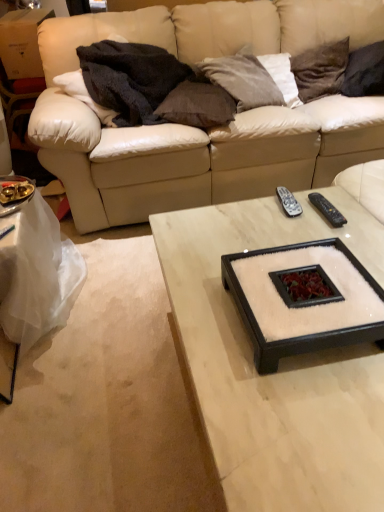
What are the coordinates of `beige leather couch at upper center` in the screenshot? It's located at (x=208, y=129).

How much space does white marble coffee table at center, which is counted as the first coffee table, starting from the right, occupy vertically?

The height of white marble coffee table at center, which is counted as the first coffee table, starting from the right, is 16.64 inches.

What is the approximate width of gray suede pillow at upper center, the 3th pillow when ordered from right to left?

It is 15.73 inches.

What is the approximate height of black plastic remote control at center, the 1th remote control from the left?

The height of black plastic remote control at center, the 1th remote control from the left, is 1.70 inches.

What is the approximate width of white felt square tray at center?

white felt square tray at center is 15.05 inches wide.

This screenshot has height=512, width=384. What do you see at coordinates (365, 71) in the screenshot?
I see `dark gray fabric pillow at upper right, acting as the 4th pillow starting from the left` at bounding box center [365, 71].

The width and height of the screenshot is (384, 512). Identify the location of beige leather couch at upper center. (208, 129).

Which of these two, brown fabric pillow at upper center, which ranks as the first pillow in left-to-right order, or white felt square tray at center, stands shorter?

Standing shorter between the two is white felt square tray at center.

Which is correct: brown fabric pillow at upper center, arranged as the 4th pillow when viewed from the right, is inside white felt square tray at center, or outside of it?

brown fabric pillow at upper center, arranged as the 4th pillow when viewed from the right, lies outside white felt square tray at center.

Where is `the 1st pillow behind the white felt square tray at center`? This screenshot has width=384, height=512. the 1st pillow behind the white felt square tray at center is located at coordinates (197, 105).

Is brown fabric pillow at upper center, which ranks as the first pillow in left-to-right order, looking in the opposite direction of white felt square tray at center?

No, brown fabric pillow at upper center, which ranks as the first pillow in left-to-right order,'s orientation is not away from white felt square tray at center.

Is black plastic remote control at right, marked as the second remote control in a left-to-right arrangement, outside of dark fuzzy blanket at upper left?

Yes, black plastic remote control at right, marked as the second remote control in a left-to-right arrangement, is located beyond the bounds of dark fuzzy blanket at upper left.

Is black plastic remote control at right, marked as the first remote control in a right-to-left arrangement, oriented towards dark fuzzy blanket at upper left?

No, black plastic remote control at right, marked as the first remote control in a right-to-left arrangement, is not oriented towards dark fuzzy blanket at upper left.

Considering the positions of objects black plastic remote control at right, marked as the second remote control in a left-to-right arrangement, and dark fuzzy blanket at upper left in the image provided, who is behind, black plastic remote control at right, marked as the second remote control in a left-to-right arrangement, or dark fuzzy blanket at upper left?

Positioned behind is dark fuzzy blanket at upper left.

Considering the relative positions of black plastic remote control at right, marked as the first remote control in a right-to-left arrangement, and dark fuzzy blanket at upper left in the image provided, is black plastic remote control at right, marked as the first remote control in a right-to-left arrangement, to the left or to the right of dark fuzzy blanket at upper left?

Based on their positions, black plastic remote control at right, marked as the first remote control in a right-to-left arrangement, is located to the right of dark fuzzy blanket at upper left.

Between black plastic remote control at right, marked as the second remote control in a left-to-right arrangement, and dark brown velvet pillow at upper right, which appears as the 3th pillow when viewed from the left, which one has smaller width?

With smaller width is black plastic remote control at right, marked as the second remote control in a left-to-right arrangement.

Looking at this image, considering their positions, is black plastic remote control at right, marked as the first remote control in a right-to-left arrangement, located in front of or behind dark brown velvet pillow at upper right, which appears as the 3th pillow when viewed from the left?

Clearly, black plastic remote control at right, marked as the first remote control in a right-to-left arrangement, is in front of dark brown velvet pillow at upper right, which appears as the 3th pillow when viewed from the left.

From a real-world perspective, is black plastic remote control at right, marked as the second remote control in a left-to-right arrangement, beneath dark brown velvet pillow at upper right, the 2th pillow viewed from the right?

Yes, from a real-world perspective, black plastic remote control at right, marked as the second remote control in a left-to-right arrangement, is below dark brown velvet pillow at upper right, the 2th pillow viewed from the right.

How different are the orientations of black plastic remote control at right, marked as the first remote control in a right-to-left arrangement, and dark brown velvet pillow at upper right, which appears as the 3th pillow when viewed from the left, in degrees?

The facing directions of black plastic remote control at right, marked as the first remote control in a right-to-left arrangement, and dark brown velvet pillow at upper right, which appears as the 3th pillow when viewed from the left, are 86.1 degrees apart.

Looking at the image, does dark brown velvet pillow at upper right, the 2th pillow viewed from the right, seem bigger or smaller compared to white marble coffee table at lower left, the 1th coffee table viewed from the left?

Clearly, dark brown velvet pillow at upper right, the 2th pillow viewed from the right, is smaller in size than white marble coffee table at lower left, the 1th coffee table viewed from the left.

Would you say dark brown velvet pillow at upper right, which appears as the 3th pillow when viewed from the left, is outside white marble coffee table at lower left, the 1th coffee table viewed from the left?

Yes.

Which object is thinner, dark brown velvet pillow at upper right, the 2th pillow viewed from the right, or white marble coffee table at lower left, the 1th coffee table viewed from the left?

dark brown velvet pillow at upper right, the 2th pillow viewed from the right.

Is brown fabric pillow at upper center, which ranks as the first pillow in left-to-right order, further to camera compared to gray suede pillow at upper center, placed as the second pillow when sorted from left to right?

No, it is in front of gray suede pillow at upper center, placed as the second pillow when sorted from left to right.

From a real-world perspective, is brown fabric pillow at upper center, arranged as the 4th pillow when viewed from the right, below gray suede pillow at upper center, the 3th pillow when ordered from right to left?

Yes, from a real-world perspective, brown fabric pillow at upper center, arranged as the 4th pillow when viewed from the right, is beneath gray suede pillow at upper center, the 3th pillow when ordered from right to left.

Considering the sizes of objects brown fabric pillow at upper center, which ranks as the first pillow in left-to-right order, and gray suede pillow at upper center, the 3th pillow when ordered from right to left, in the image provided, who is bigger, brown fabric pillow at upper center, which ranks as the first pillow in left-to-right order, or gray suede pillow at upper center, the 3th pillow when ordered from right to left,?

With larger size is gray suede pillow at upper center, the 3th pillow when ordered from right to left.

How many degrees apart are the facing directions of brown fabric pillow at upper center, arranged as the 4th pillow when viewed from the right, and gray suede pillow at upper center, placed as the second pillow when sorted from left to right?

The angular difference between brown fabric pillow at upper center, arranged as the 4th pillow when viewed from the right, and gray suede pillow at upper center, placed as the second pillow when sorted from left to right, is 32.8 degrees.

Looking at this image, is dark brown velvet pillow at upper right, the 2th pillow viewed from the right, outside of gray suede pillow at upper center, the 3th pillow when ordered from right to left?

dark brown velvet pillow at upper right, the 2th pillow viewed from the right, lies outside gray suede pillow at upper center, the 3th pillow when ordered from right to left,'s area.

Is dark brown velvet pillow at upper right, which appears as the 3th pillow when viewed from the left, aimed at gray suede pillow at upper center, the 3th pillow when ordered from right to left?

No, dark brown velvet pillow at upper right, which appears as the 3th pillow when viewed from the left, is not oriented towards gray suede pillow at upper center, the 3th pillow when ordered from right to left.

Which is farther, (337, 92) or (238, 87)?

The point (337, 92) is farther from the camera.

From the image's perspective, is dark brown velvet pillow at upper right, which appears as the 3th pillow when viewed from the left, positioned above or below gray suede pillow at upper center, placed as the second pillow when sorted from left to right?

Based on their image positions, dark brown velvet pillow at upper right, which appears as the 3th pillow when viewed from the left, is located above gray suede pillow at upper center, placed as the second pillow when sorted from left to right.

Is dark gray fabric pillow at upper right, acting as the 4th pillow starting from the left, inside the boundaries of black plastic remote control at center, the 2th remote control when ordered from right to left, or outside?

dark gray fabric pillow at upper right, acting as the 4th pillow starting from the left, is outside black plastic remote control at center, the 2th remote control when ordered from right to left.

What's the angular difference between dark gray fabric pillow at upper right, acting as the first pillow starting from the right, and black plastic remote control at center, the 2th remote control when ordered from right to left,'s facing directions?

There is a 98.5-degree angle between the facing directions of dark gray fabric pillow at upper right, acting as the first pillow starting from the right, and black plastic remote control at center, the 2th remote control when ordered from right to left.

Is dark gray fabric pillow at upper right, acting as the 4th pillow starting from the left, to the right of black plastic remote control at center, the 1th remote control from the left, from the viewer's perspective?

Correct, you'll find dark gray fabric pillow at upper right, acting as the 4th pillow starting from the left, to the right of black plastic remote control at center, the 1th remote control from the left.

Where is `round table located in front of the brown fabric pillow at upper center, which ranks as the first pillow in left-to-right order`? The width and height of the screenshot is (384, 512). round table located in front of the brown fabric pillow at upper center, which ranks as the first pillow in left-to-right order is located at coordinates (303, 298).

I want to click on blanket that is on the left side of black plastic remote control at right, marked as the second remote control in a left-to-right arrangement, so click(130, 79).

Looking at the image, which one is located closer to dark brown velvet pillow at upper right, which appears as the 3th pillow when viewed from the left, gray suede pillow at upper center, placed as the second pillow when sorted from left to right, or white marble coffee table at lower left, the 1th coffee table viewed from the left?

Among the two, gray suede pillow at upper center, placed as the second pillow when sorted from left to right, is located nearer to dark brown velvet pillow at upper right, which appears as the 3th pillow when viewed from the left.

Based on their spatial positions, is dark brown velvet pillow at upper right, the 2th pillow viewed from the right, or beige leather couch at upper center further from white felt square tray at center?

dark brown velvet pillow at upper right, the 2th pillow viewed from the right, is positioned further to the anchor white felt square tray at center.

Considering their positions, is white felt square tray at center positioned further to black plastic remote control at center, the 1th remote control from the left, than dark gray fabric pillow at upper right, acting as the first pillow starting from the right?

dark gray fabric pillow at upper right, acting as the first pillow starting from the right, lies further to black plastic remote control at center, the 1th remote control from the left, than the other object.

Based on their spatial positions, is white marble coffee table at lower left, which ranks as the second coffee table in right-to-left order, or black plastic remote control at center, the 2th remote control when ordered from right to left, closer to dark gray fabric pillow at upper right, acting as the first pillow starting from the right?

The object closer to dark gray fabric pillow at upper right, acting as the first pillow starting from the right, is black plastic remote control at center, the 2th remote control when ordered from right to left.

Based on their spatial positions, is white marble coffee table at lower left, which ranks as the second coffee table in right-to-left order, or black plastic remote control at right, marked as the first remote control in a right-to-left arrangement, closer to dark fuzzy blanket at upper left?

white marble coffee table at lower left, which ranks as the second coffee table in right-to-left order, is positioned closer to the anchor dark fuzzy blanket at upper left.

In the scene shown: From the image, which object appears to be farther from black plastic remote control at center, the 2th remote control when ordered from right to left, black plastic remote control at right, marked as the first remote control in a right-to-left arrangement, or beige leather couch at upper center?

beige leather couch at upper center is further to black plastic remote control at center, the 2th remote control when ordered from right to left.

From the image, which object appears to be farther from white felt square tray at center, beige leather couch at upper center or dark brown velvet pillow at upper right, the 2th pillow viewed from the right?

Among the two, dark brown velvet pillow at upper right, the 2th pillow viewed from the right, is located further to white felt square tray at center.

Based on their spatial positions, is dark fuzzy blanket at upper left or beige leather couch at upper center further from black plastic remote control at right, marked as the second remote control in a left-to-right arrangement?

dark fuzzy blanket at upper left lies further to black plastic remote control at right, marked as the second remote control in a left-to-right arrangement, than the other object.

Locate an element on the screen. studio couch between dark fuzzy blanket at upper left and white marble coffee table at lower left, which ranks as the second coffee table in right-to-left order, from top to bottom is located at coordinates (208, 129).

Image resolution: width=384 pixels, height=512 pixels. I want to click on remote control between beige leather couch at upper center and black plastic remote control at right, marked as the second remote control in a left-to-right arrangement, vertically, so 288,202.

Locate an element on the screen. remote control between dark gray fabric pillow at upper right, acting as the 4th pillow starting from the left, and black plastic remote control at right, marked as the first remote control in a right-to-left arrangement, in the vertical direction is located at coordinates (288, 202).

At what (x,y) coordinates should I click in order to perform the action: click on studio couch between gray suede pillow at upper center, placed as the second pillow when sorted from left to right, and black plastic remote control at right, marked as the second remote control in a left-to-right arrangement, from top to bottom. Please return your answer as a coordinate pair (x, y). Looking at the image, I should click on (208, 129).